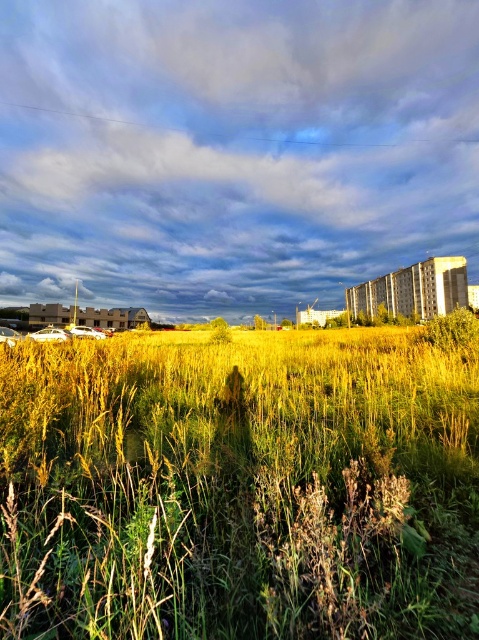
How far apart are yellow grass at center and cloudy sky at upper center?

A distance of 63.36 meters exists between yellow grass at center and cloudy sky at upper center.

What do you see at coordinates (241, 484) in the screenshot?
I see `yellow grass at center` at bounding box center [241, 484].

Find the location of `yellow grass at center`. yellow grass at center is located at coordinates (241, 484).